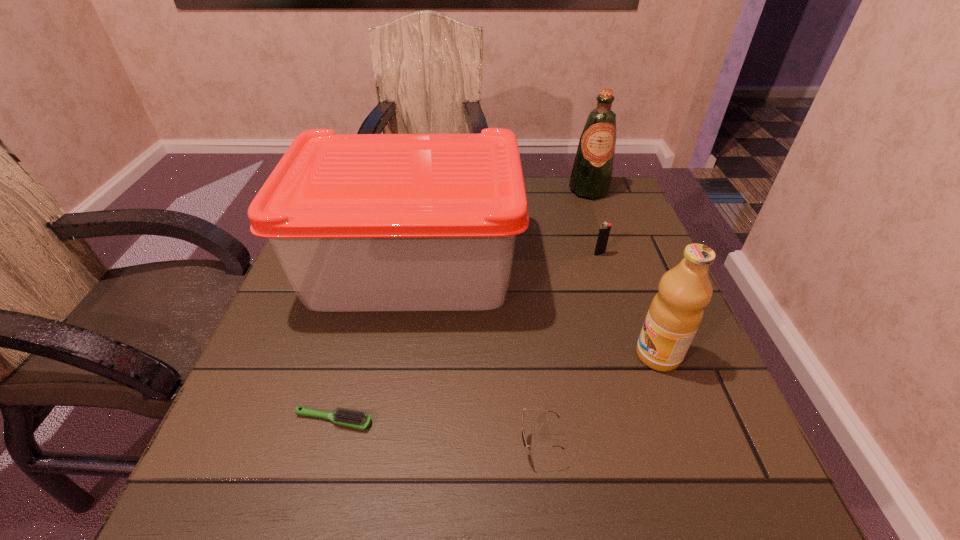
At what (x,y) coordinates should I click in order to perform the action: click on free spot between the shortest object and the tray. Please return your answer as a coordinate pair (x, y). The width and height of the screenshot is (960, 540). Looking at the image, I should click on (372, 343).

Identify the location of empty location between the sunglasses and the farthest object. The image size is (960, 540). (564, 318).

Locate an element on the screen. Image resolution: width=960 pixels, height=540 pixels. free spot between the tray and the sunglasses is located at coordinates (475, 355).

The width and height of the screenshot is (960, 540). Identify the location of vacant space that is in between the third shortest object and the shortest object. (x=467, y=337).

At what (x,y) coordinates should I click in order to perform the action: click on free space between the sunglasses and the tray. Please return your answer as a coordinate pair (x, y). This screenshot has width=960, height=540. Looking at the image, I should click on (475, 355).

You are a GUI agent. You are given a task and a screenshot of the screen. Output one action in this format:
    pyautogui.click(x=<x>, y=<y>)
    Task: Click on the free space between the fourth farthest object and the hairbrush
    The image size is (960, 540).
    Given the screenshot: What is the action you would take?
    pyautogui.click(x=495, y=388)

The width and height of the screenshot is (960, 540). Identify the location of vacant area that lies between the fifth tallest object and the tray. (475, 355).

The image size is (960, 540). I want to click on free area in between the third nearest object and the sunglasses, so click(598, 400).

Locate an element on the screen. object that can be found as the fifth closest to the shortest object is located at coordinates (591, 176).

Find the location of a particular element. the fourth closest object to the nearer olive oil is located at coordinates (355, 419).